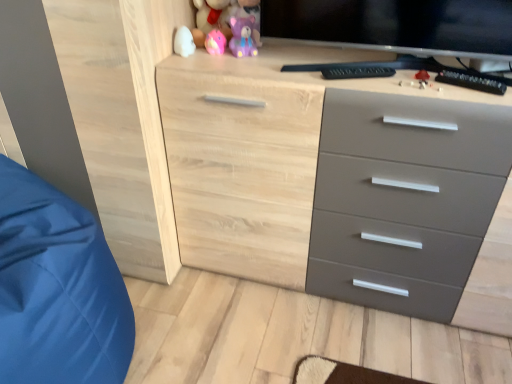
Identify the location of pink plush bear at upper center, the first toy in the top-to-bottom sequence. (218, 24).

Describe the element at coordinates (218, 24) in the screenshot. I see `pink plush bear at upper center, the fourth toy from the bottom` at that location.

Describe the element at coordinates (183, 42) in the screenshot. I see `white glossy egg at upper left, the first toy when ordered from bottom to top` at that location.

Identify the location of purple matte bear at upper center, the 3th toy from the top. (242, 37).

Identify the location of natural wood chest of drawers at center. Image resolution: width=512 pixels, height=384 pixels. (254, 155).

How many degrees apart are the facing directions of pink rubber duck at upper center, the 2th toy from the top, and purple matte bear at upper center, which ranks as the 2th toy in bottom-to-top order?

pink rubber duck at upper center, the 2th toy from the top, and purple matte bear at upper center, which ranks as the 2th toy in bottom-to-top order, are facing 0.00053 degrees away from each other.

Find the location of `the 2nd toy counting from the right of the pink rubber duck at upper center, marked as the third toy in a bottom-to-top arrangement`. the 2nd toy counting from the right of the pink rubber duck at upper center, marked as the third toy in a bottom-to-top arrangement is located at coordinates (242, 37).

In the scene shown: From a real-world perspective, is pink rubber duck at upper center, the 2th toy from the top, positioned above or below purple matte bear at upper center, the 3th toy from the top?

In terms of real-world spatial position, pink rubber duck at upper center, the 2th toy from the top, is below purple matte bear at upper center, the 3th toy from the top.

Does pink rubber duck at upper center, the 2th toy from the top, appear on the right side of purple matte bear at upper center, which ranks as the 2th toy in bottom-to-top order?

No.

Which is correct: purple matte bear at upper center, which ranks as the 2th toy in bottom-to-top order, is inside white glossy egg at upper left, the first toy when ordered from bottom to top, or outside of it?

purple matte bear at upper center, which ranks as the 2th toy in bottom-to-top order, cannot be found inside white glossy egg at upper left, the first toy when ordered from bottom to top.

Is purple matte bear at upper center, which ranks as the 2th toy in bottom-to-top order, wider than white glossy egg at upper left, positioned as the 4th toy in top-to-bottom order?

Yes.

Is purple matte bear at upper center, which ranks as the 2th toy in bottom-to-top order, to the right of white glossy egg at upper left, positioned as the 4th toy in top-to-bottom order, from the viewer's perspective?

Indeed, purple matte bear at upper center, which ranks as the 2th toy in bottom-to-top order, is positioned on the right side of white glossy egg at upper left, positioned as the 4th toy in top-to-bottom order.

Could you tell me if white glossy egg at upper left, the first toy when ordered from bottom to top, is turned towards pink rubber duck at upper center, marked as the third toy in a bottom-to-top arrangement?

No, white glossy egg at upper left, the first toy when ordered from bottom to top, does not turn towards pink rubber duck at upper center, marked as the third toy in a bottom-to-top arrangement.

Considering the sizes of objects white glossy egg at upper left, the first toy when ordered from bottom to top, and pink rubber duck at upper center, marked as the third toy in a bottom-to-top arrangement, in the image provided, who is shorter, white glossy egg at upper left, the first toy when ordered from bottom to top, or pink rubber duck at upper center, marked as the third toy in a bottom-to-top arrangement,?

Standing shorter between the two is pink rubber duck at upper center, marked as the third toy in a bottom-to-top arrangement.

Does point (181, 36) come farther from viewer compared to point (211, 49)?

Yes, it is.

From the image's perspective, who appears lower, white glossy egg at upper left, the first toy when ordered from bottom to top, or pink rubber duck at upper center, marked as the third toy in a bottom-to-top arrangement?

white glossy egg at upper left, the first toy when ordered from bottom to top, is shown below in the image.

Looking at this image, is blue satin sleeping bag at left bigger than pink rubber duck at upper center, the 2th toy from the top?

Correct, blue satin sleeping bag at left is larger in size than pink rubber duck at upper center, the 2th toy from the top.

Identify the location of sleeping bag on the left of pink rubber duck at upper center, marked as the third toy in a bottom-to-top arrangement. (57, 289).

Considering the positions of point (95, 380) and point (207, 49), is point (95, 380) closer or farther from the camera than point (207, 49)?

Point (95, 380) appears to be closer to the viewer than point (207, 49).

How different are the orientations of white glossy egg at upper left, positioned as the 4th toy in top-to-bottom order, and natural wood chest of drawers at center in degrees?

The angle between the facing direction of white glossy egg at upper left, positioned as the 4th toy in top-to-bottom order, and the facing direction of natural wood chest of drawers at center is 0.34 degrees.

Is white glossy egg at upper left, the first toy when ordered from bottom to top, surrounding natural wood chest of drawers at center?

No, natural wood chest of drawers at center is not a part of white glossy egg at upper left, the first toy when ordered from bottom to top.

From a real-world perspective, which object stands above the other?

white glossy egg at upper left, positioned as the 4th toy in top-to-bottom order, from a real-world perspective.

Who is bigger, white glossy egg at upper left, positioned as the 4th toy in top-to-bottom order, or natural wood chest of drawers at center?

natural wood chest of drawers at center is bigger.

Can you confirm if pink plush bear at upper center, the first toy in the top-to-bottom sequence, is thinner than blue satin sleeping bag at left?

Yes.

I want to click on sleeping bag below the pink plush bear at upper center, the fourth toy from the bottom (from the image's perspective), so click(57, 289).

Based on the photo, from the image's perspective, who appears lower, pink plush bear at upper center, the first toy in the top-to-bottom sequence, or blue satin sleeping bag at left?

From the image's view, blue satin sleeping bag at left is below.

From the picture: Which object is further away from the camera taking this photo, pink plush bear at upper center, the fourth toy from the bottom, or blue satin sleeping bag at left?

pink plush bear at upper center, the fourth toy from the bottom.

From a real-world perspective, which object stands above the other?

pink plush bear at upper center, the first toy in the top-to-bottom sequence, is physically above.

Is pink plush bear at upper center, the fourth toy from the bottom, in front of or behind natural wood chest of drawers at center in the image?

pink plush bear at upper center, the fourth toy from the bottom, is behind natural wood chest of drawers at center.

Between pink plush bear at upper center, the fourth toy from the bottom, and natural wood chest of drawers at center, which one has less height?

With less height is pink plush bear at upper center, the fourth toy from the bottom.

Identify the location of the 1st toy below the pink rubber duck at upper center, marked as the third toy in a bottom-to-top arrangement (from the image's perspective). (242, 37).

I want to click on the 3rd toy counting from the right side of the white glossy egg at upper left, positioned as the 4th toy in top-to-bottom order, so click(242, 37).

Which object lies nearer to the anchor point pink rubber duck at upper center, marked as the third toy in a bottom-to-top arrangement, blue satin sleeping bag at left or purple matte bear at upper center, the 3th toy from the top?

purple matte bear at upper center, the 3th toy from the top, lies closer to pink rubber duck at upper center, marked as the third toy in a bottom-to-top arrangement, than the other object.

Estimate the real-world distances between objects in this image. Which object is closer to natural wood chest of drawers at center, white glossy egg at upper left, the first toy when ordered from bottom to top, or pink rubber duck at upper center, marked as the third toy in a bottom-to-top arrangement?

pink rubber duck at upper center, marked as the third toy in a bottom-to-top arrangement.

From the image, which object appears to be farther from white glossy egg at upper left, the first toy when ordered from bottom to top, pink plush bear at upper center, the first toy in the top-to-bottom sequence, or natural wood chest of drawers at center?

natural wood chest of drawers at center is further to white glossy egg at upper left, the first toy when ordered from bottom to top.

From the image, which object appears to be nearer to natural wood chest of drawers at center, purple matte bear at upper center, which ranks as the 2th toy in bottom-to-top order, or pink rubber duck at upper center, the 2th toy from the top?

Among the two, purple matte bear at upper center, which ranks as the 2th toy in bottom-to-top order, is located nearer to natural wood chest of drawers at center.

Looking at the image, which one is located further to purple matte bear at upper center, the 3th toy from the top, natural wood chest of drawers at center or pink plush bear at upper center, the first toy in the top-to-bottom sequence?

Based on the image, natural wood chest of drawers at center appears to be further to purple matte bear at upper center, the 3th toy from the top.

When comparing their distances from white glossy egg at upper left, positioned as the 4th toy in top-to-bottom order, does pink rubber duck at upper center, marked as the third toy in a bottom-to-top arrangement, or pink plush bear at upper center, the fourth toy from the bottom, seem further?

The object further to white glossy egg at upper left, positioned as the 4th toy in top-to-bottom order, is pink plush bear at upper center, the fourth toy from the bottom.

Looking at the image, which one is located further to white glossy egg at upper left, positioned as the 4th toy in top-to-bottom order, pink rubber duck at upper center, marked as the third toy in a bottom-to-top arrangement, or blue satin sleeping bag at left?

The object further to white glossy egg at upper left, positioned as the 4th toy in top-to-bottom order, is blue satin sleeping bag at left.

Which object lies nearer to the anchor point pink plush bear at upper center, the first toy in the top-to-bottom sequence, purple matte bear at upper center, the 3th toy from the top, or natural wood chest of drawers at center?

purple matte bear at upper center, the 3th toy from the top, lies closer to pink plush bear at upper center, the first toy in the top-to-bottom sequence, than the other object.

What are the coordinates of `toy between pink plush bear at upper center, the fourth toy from the bottom, and purple matte bear at upper center, which ranks as the 2th toy in bottom-to-top order, vertically` in the screenshot? It's located at (215, 42).

The image size is (512, 384). I want to click on toy that lies between purple matte bear at upper center, which ranks as the 2th toy in bottom-to-top order, and blue satin sleeping bag at left from top to bottom, so click(183, 42).